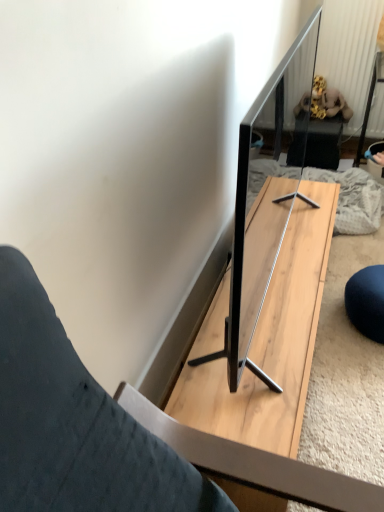
Question: From the image's perspective, is light wood table at center located above or below velvet plush toy at upper right?

Choices:
 (A) above
 (B) below

Answer: (B)

Question: From a real-world perspective, relative to velvet plush toy at upper right, is light wood table at center vertically above or below?

Choices:
 (A) above
 (B) below

Answer: (B)

Question: In the image, is light wood table at center positioned in front of or behind velvet plush toy at upper right?

Choices:
 (A) behind
 (B) front

Answer: (B)

Question: Considering the positions of velvet plush toy at upper right and light wood table at center in the image, is velvet plush toy at upper right wider or thinner than light wood table at center?

Choices:
 (A) thin
 (B) wide

Answer: (A)

Question: From the image's perspective, is velvet plush toy at upper right positioned above or below light wood table at center?

Choices:
 (A) above
 (B) below

Answer: (A)

Question: Considering the positions of point (319, 158) and point (289, 433), is point (319, 158) closer or farther from the camera than point (289, 433)?

Choices:
 (A) farther
 (B) closer

Answer: (A)

Question: Based on their positions, is velvet plush toy at upper right located to the left or right of light wood table at center?

Choices:
 (A) left
 (B) right

Answer: (B)